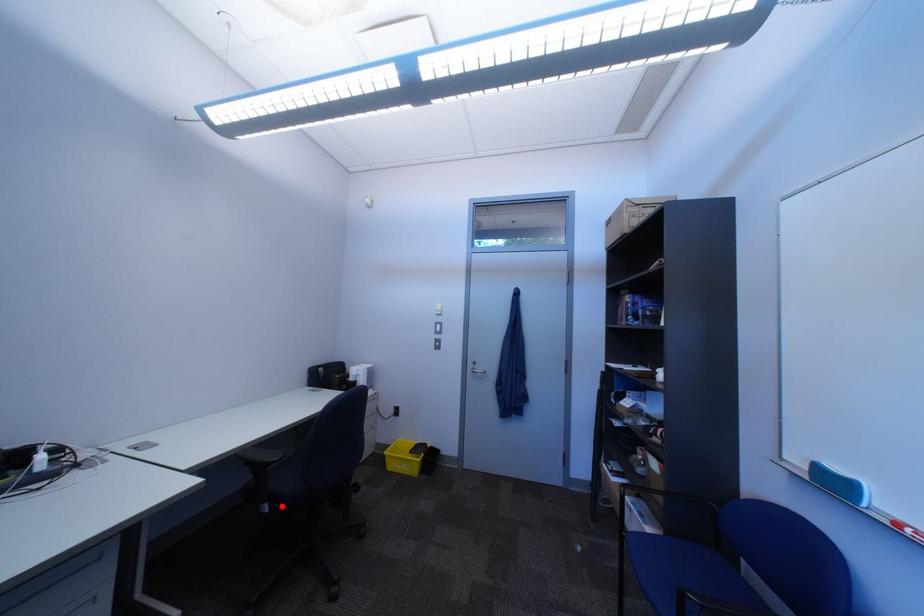
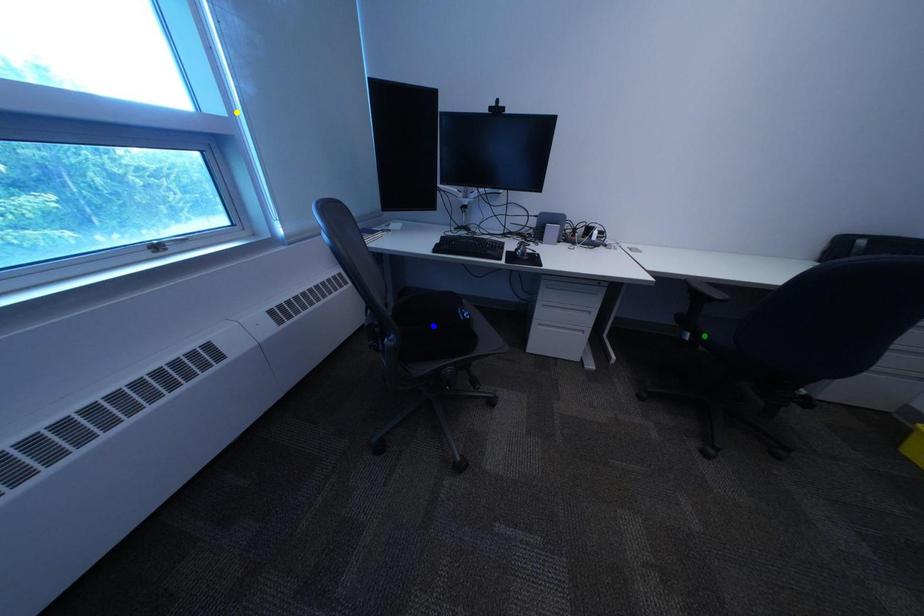
Question: I am providing you with two images of the same scene from different viewpoints. A red point is marked on the first image. You are given multiple points on the second image. Which spot in image 2 lines up with the point in image 1?

Choices:
 (A) green point
 (B) blue point
 (C) yellow point

Answer: (A)